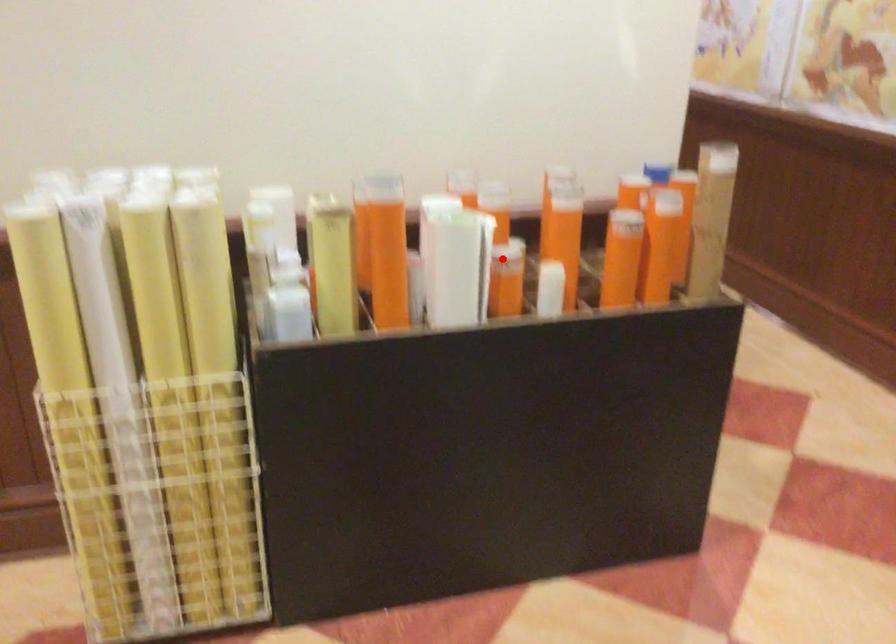
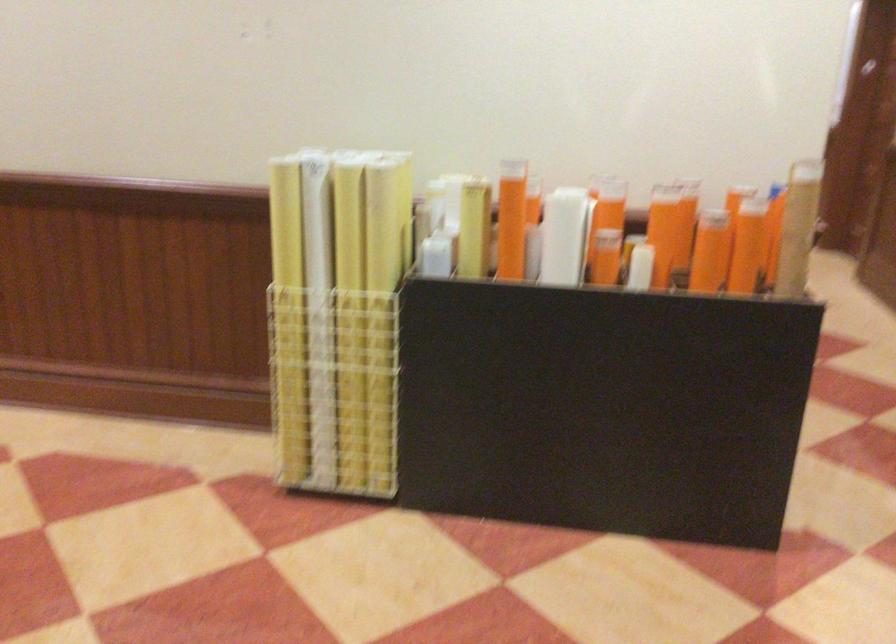
Locate, in the second image, the point that corresponds to the highlighted location in the first image.

(606, 241)